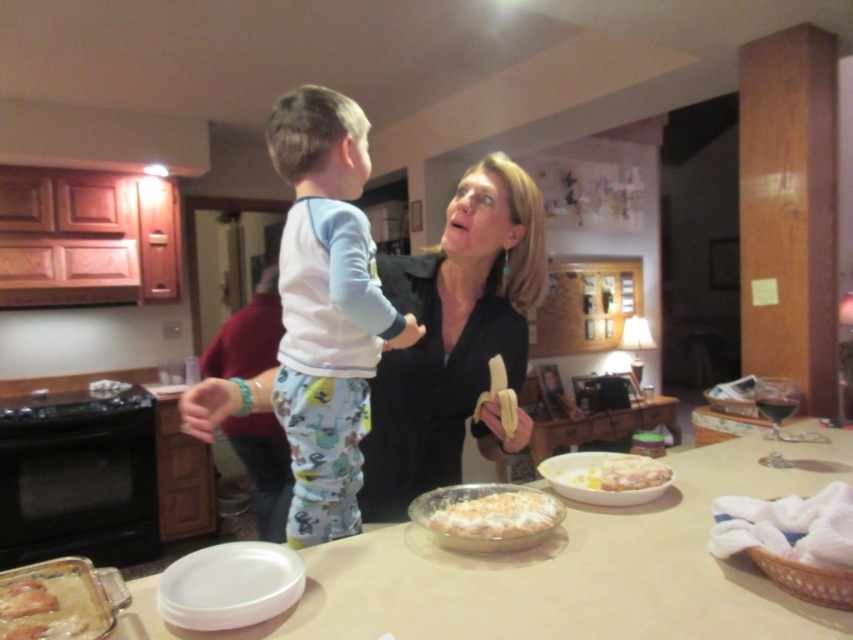
You are standing in the kitchen and want to place a small plant between the two points, point (x=303, y=348) and point (x=448, y=525). Which point should the plant be closer to in order to be placed behind the second point?

The plant should be closer to point (x=448, y=525) because point (x=303, y=348) is behind point (x=448, y=525), so placing it near the second point would position it behind the second point.

You are a parent trying to decide which item to pick up first in the kitchen. You see the light blue cotton pajamas at center and the white fluffy pie at center. Which item is located to the left?

The light blue cotton pajamas at center are located to the left of the white fluffy pie at center.

You are standing in the kitchen and want to reach both points in the scene. Which point, point (364, 269) or point (583, 474), will you reach first if you move directly toward them?

You will reach point (364, 269) first because it is closer to you than point (583, 474).